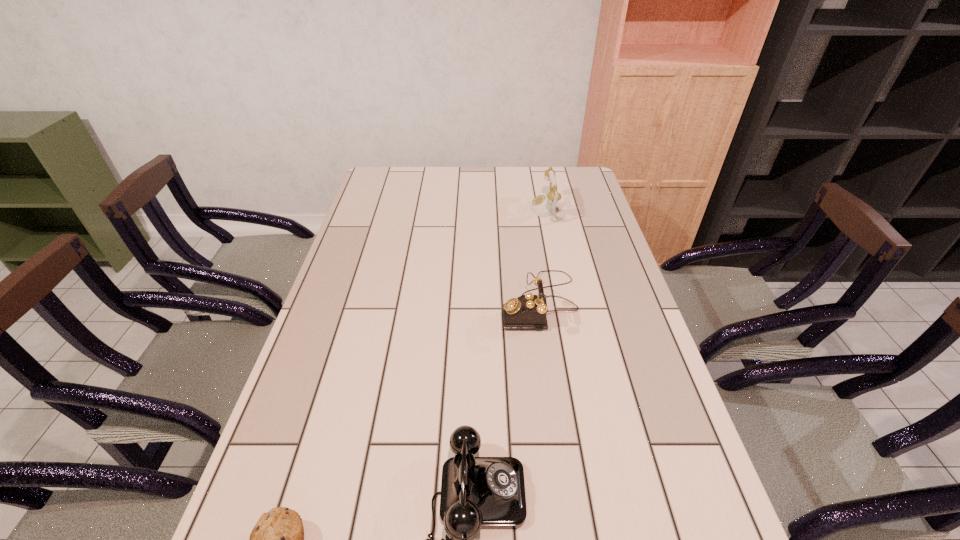
This screenshot has width=960, height=540. I want to click on the farthest telephone, so click(x=543, y=205).

Find the location of a particular element. This screenshot has width=960, height=540. the third nearest object is located at coordinates (528, 311).

The width and height of the screenshot is (960, 540). Find the location of `free space located 0.090m on the dial of the farthest object`. free space located 0.090m on the dial of the farthest object is located at coordinates (506, 210).

Where is `vacant space located 0.320m on the dial of the farthest object`? The image size is (960, 540). vacant space located 0.320m on the dial of the farthest object is located at coordinates (443, 210).

At what (x,y) coordinates should I click in order to perform the action: click on vacant region located 0.190m on the dial of the farthest object. Please return your answer as a coordinate pair (x, y). Looking at the image, I should click on (478, 210).

The height and width of the screenshot is (540, 960). Identify the location of free space located on the dial of the second farthest telephone. (387, 302).

In order to click on free space located on the dial of the second farthest telephone in this screenshot , I will do `click(483, 302)`.

Locate an element on the screen. The height and width of the screenshot is (540, 960). free space located on the dial of the second farthest telephone is located at coordinates (416, 302).

Where is `object at the far edge`? object at the far edge is located at coordinates (543, 205).

I want to click on object located at the far right corner, so [x=543, y=205].